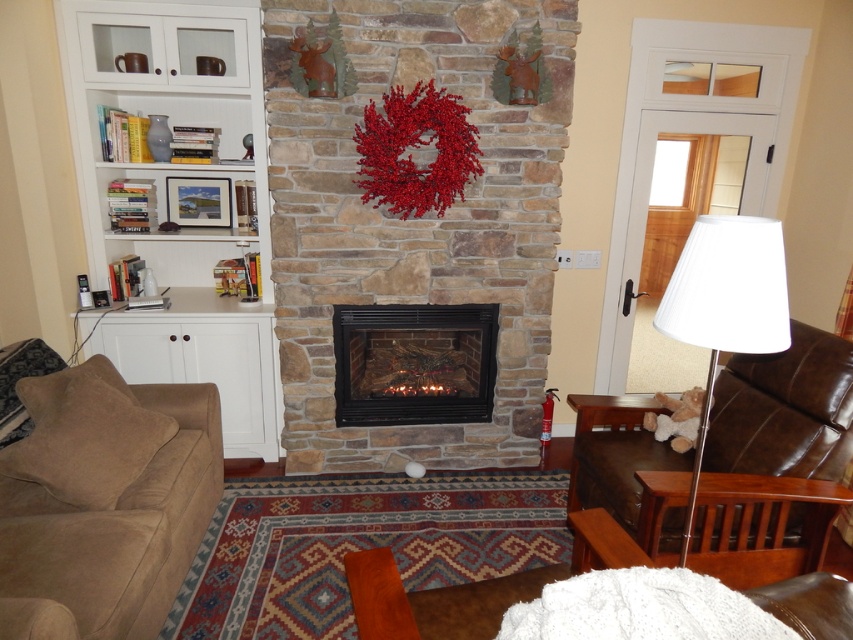
Looking at this image, is white wood bookshelf at left positioned in front of brown leather armchair at right?

No, it is not.

Between point (123, 38) and point (637, 532), which one is positioned behind?

Point (123, 38)

Where is `white wood bookshelf at left`? The image size is (853, 640). white wood bookshelf at left is located at coordinates (181, 198).

Can you confirm if brown leather armchair at right is smaller than black glass fireplace at center?

Incorrect, brown leather armchair at right is not smaller in size than black glass fireplace at center.

Between brown leather armchair at right and black glass fireplace at center, which one is positioned lower?

brown leather armchair at right is lower down.

Where is `brown leather armchair at right`? The image size is (853, 640). brown leather armchair at right is located at coordinates (784, 410).

You are a GUI agent. You are given a task and a screenshot of the screen. Output one action in this format:
    pyautogui.click(x=<x>, y=<y>)
    Task: Click on the brown leather armchair at right
    This screenshot has width=853, height=640.
    Given the screenshot: What is the action you would take?
    pyautogui.click(x=784, y=410)

Is black glass fireplace at center behind white fabric lampshade at right?

Yes, it is behind white fabric lampshade at right.

Who is more forward, (440,394) or (717,243)?

Point (717,243) is in front.

At what (x,y) coordinates should I click in order to perform the action: click on black glass fireplace at center. Please return your answer as a coordinate pair (x, y). The width and height of the screenshot is (853, 640). Looking at the image, I should click on tap(415, 364).